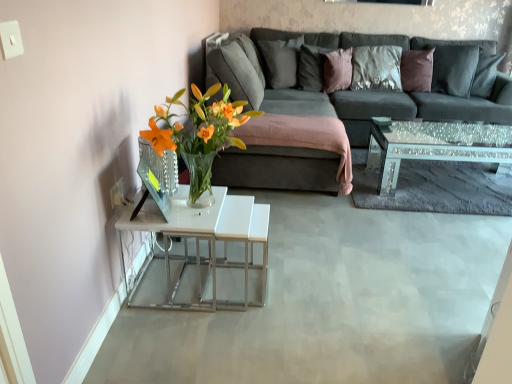
Question: Can you confirm if velvet gray pillow at upper center, which appears as the third pillow when viewed from the right, is thinner than mirrored glass coffee table at right?

Choices:
 (A) yes
 (B) no

Answer: (A)

Question: From the image's perspective, does velvet gray pillow at upper center, the 1th pillow positioned from the left, appear lower than mirrored glass coffee table at right?

Choices:
 (A) yes
 (B) no

Answer: (B)

Question: Considering the relative positions of velvet gray pillow at upper center, which appears as the third pillow when viewed from the right, and mirrored glass coffee table at right in the image provided, is velvet gray pillow at upper center, which appears as the third pillow when viewed from the right, to the right of mirrored glass coffee table at right from the viewer's perspective?

Choices:
 (A) no
 (B) yes

Answer: (A)

Question: Is velvet gray pillow at upper center, the 1th pillow positioned from the left, oriented away from mirrored glass coffee table at right?

Choices:
 (A) no
 (B) yes

Answer: (A)

Question: Can you confirm if velvet gray pillow at upper center, which appears as the third pillow when viewed from the right, is shorter than mirrored glass coffee table at right?

Choices:
 (A) yes
 (B) no

Answer: (B)

Question: From a real-world perspective, is velvet gray pillow at upper center, which appears as the third pillow when viewed from the right, positioned above or below mirrored glass coffee table at right?

Choices:
 (A) above
 (B) below

Answer: (A)

Question: Is velvet gray pillow at upper center, which appears as the third pillow when viewed from the right, bigger or smaller than mirrored glass coffee table at right?

Choices:
 (A) small
 (B) big

Answer: (A)

Question: Is velvet gray pillow at upper center, the 1th pillow positioned from the left, wider or thinner than mirrored glass coffee table at right?

Choices:
 (A) wide
 (B) thin

Answer: (B)

Question: In the image, is velvet gray pillow at upper center, which appears as the third pillow when viewed from the right, positioned in front of or behind mirrored glass coffee table at right?

Choices:
 (A) behind
 (B) front

Answer: (A)

Question: In the image, is dark gray fabric couch at center positioned in front of or behind velvet gray pillow at upper center, the 1th pillow positioned from the left?

Choices:
 (A) front
 (B) behind

Answer: (A)

Question: Based on their sizes in the image, would you say dark gray fabric couch at center is bigger or smaller than velvet gray pillow at upper center, which appears as the third pillow when viewed from the right?

Choices:
 (A) small
 (B) big

Answer: (B)

Question: Is dark gray fabric couch at center wider or thinner than velvet gray pillow at upper center, the 1th pillow positioned from the left?

Choices:
 (A) thin
 (B) wide

Answer: (B)

Question: From their relative heights in the image, would you say dark gray fabric couch at center is taller or shorter than velvet gray pillow at upper center, the 1th pillow positioned from the left?

Choices:
 (A) short
 (B) tall

Answer: (B)

Question: Is pink velvet pillow at upper center, which appears as the second pillow when viewed from the right, wider or thinner than dark gray fabric couch at center?

Choices:
 (A) thin
 (B) wide

Answer: (A)

Question: From a real-world perspective, is pink velvet pillow at upper center, placed as the 2th pillow when sorted from left to right, physically located above or below dark gray fabric couch at center?

Choices:
 (A) below
 (B) above

Answer: (B)